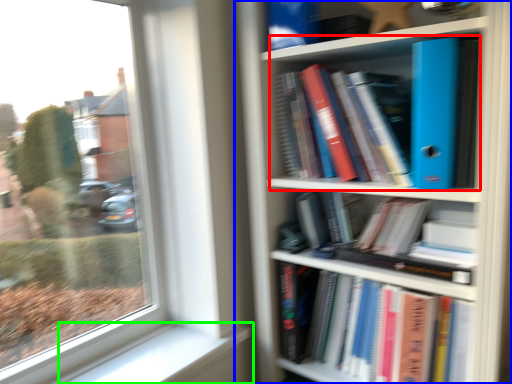
Question: Estimate the real-world distances between objects in this image. Which object is farther from book (highlighted by a red box), bookcase (highlighted by a blue box) or window sill (highlighted by a green box)?

Choices:
 (A) bookcase
 (B) window sill

Answer: (B)